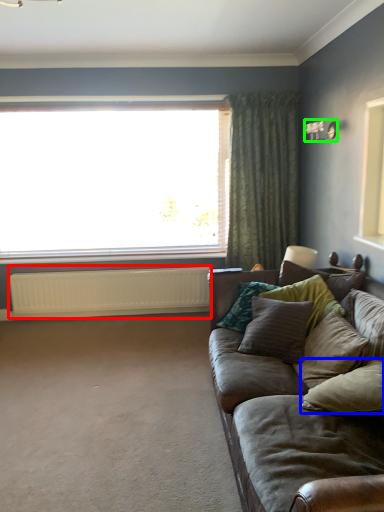
Question: Estimate the real-world distances between objects in this image. Which object is farther from radiator (highlighted by a red box), pillow (highlighted by a blue box) or light fixture (highlighted by a green box)?

Choices:
 (A) pillow
 (B) light fixture

Answer: (A)